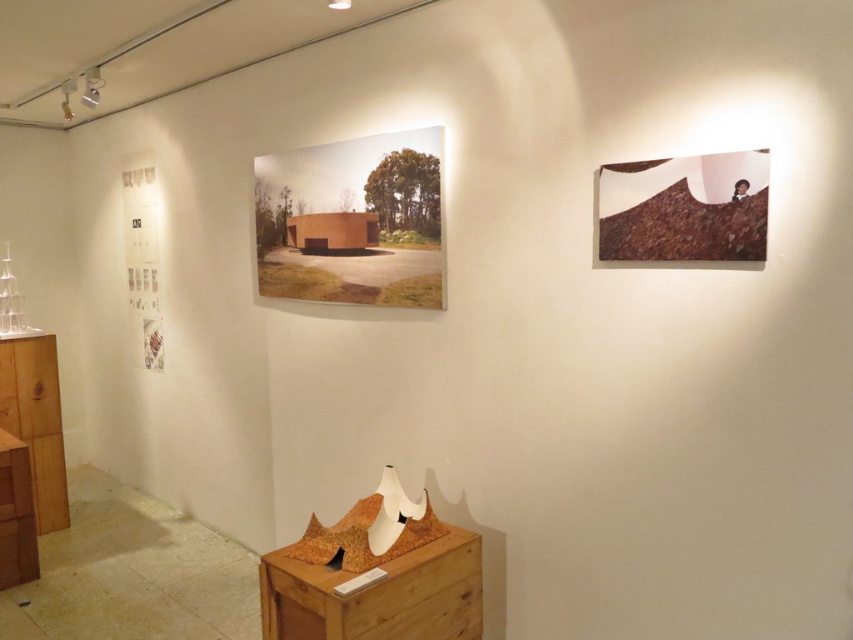
Which is more to the right, matte brown painting at center or brown textured fabric at upper right?

brown textured fabric at upper right is more to the right.

Locate an element on the screen. matte brown painting at center is located at coordinates (352, 221).

This screenshot has height=640, width=853. Identify the location of matte brown painting at center. (352, 221).

Does wooden dresser at lower center have a smaller size compared to brown textured fabric at upper right?

Actually, wooden dresser at lower center might be larger than brown textured fabric at upper right.

Does wooden dresser at lower center have a lesser height compared to brown textured fabric at upper right?

No, wooden dresser at lower center is not shorter than brown textured fabric at upper right.

The height and width of the screenshot is (640, 853). What do you see at coordinates (378, 595) in the screenshot?
I see `wooden dresser at lower center` at bounding box center [378, 595].

The height and width of the screenshot is (640, 853). In order to click on wooden dresser at lower center in this screenshot , I will do `click(378, 595)`.

Who is positioned more to the right, brown textured fabric at upper right or wooden dresser at lower left?

brown textured fabric at upper right is more to the right.

Is brown textured fabric at upper right bigger than wooden dresser at lower left?

Actually, brown textured fabric at upper right might be smaller than wooden dresser at lower left.

Between point (706, 218) and point (16, 444), which one is positioned in front?

Point (706, 218)

The height and width of the screenshot is (640, 853). Identify the location of brown textured fabric at upper right. (683, 209).